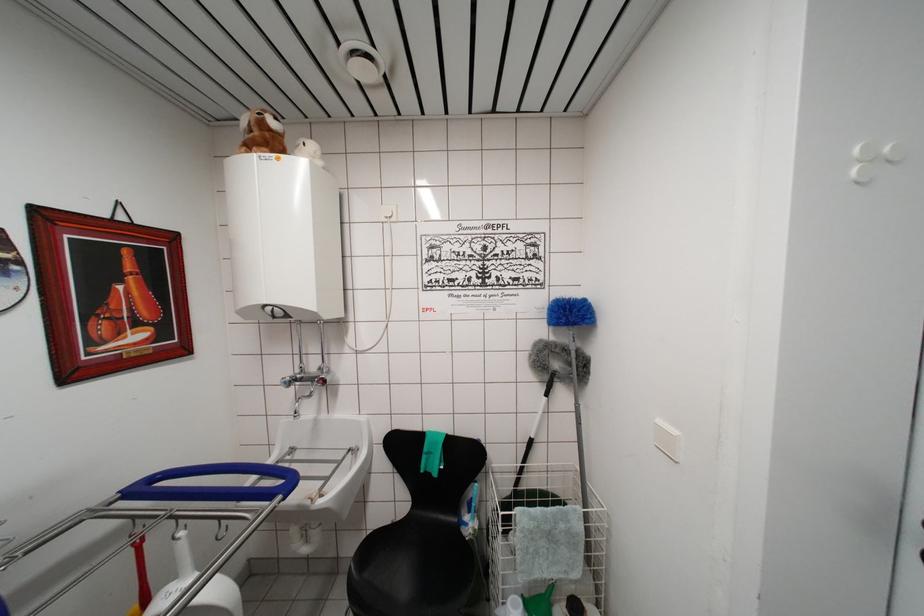
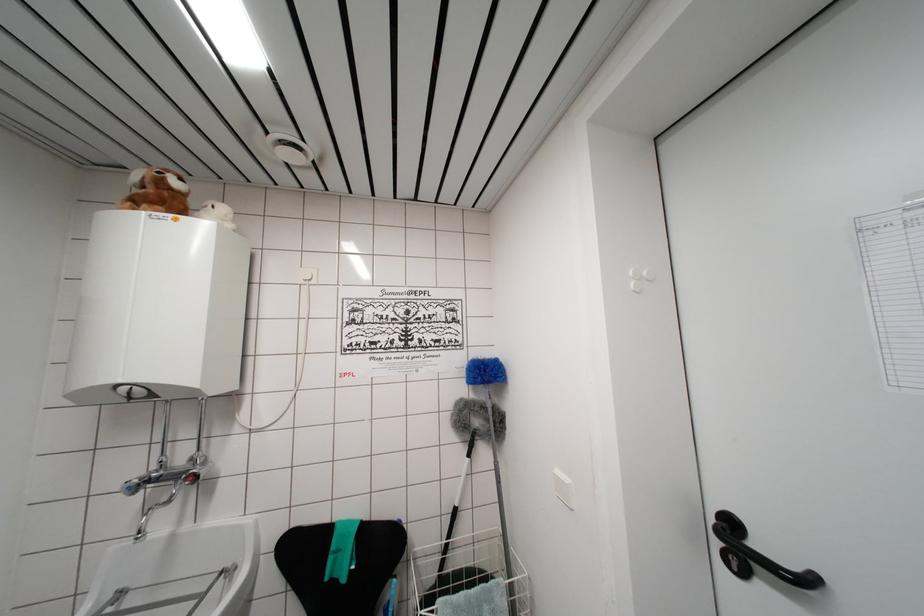
What movement of the cameraman would produce the second image?

The movement direction of the cameraman is right, backward.